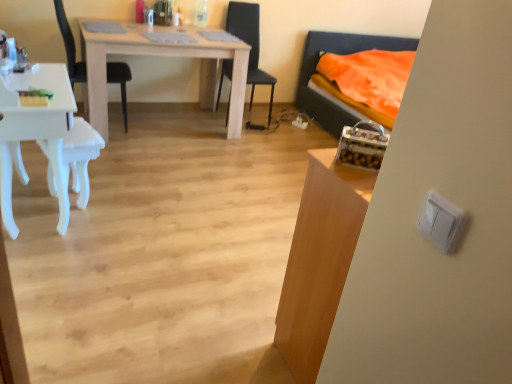
The image size is (512, 384). Find the location of `vacant area that lies between white glossy switch at right, which ranks as the second table in left-to-right order, and black plastic chair at upper left, the 1th chair in the left-to-right sequence`. vacant area that lies between white glossy switch at right, which ranks as the second table in left-to-right order, and black plastic chair at upper left, the 1th chair in the left-to-right sequence is located at coordinates (185, 212).